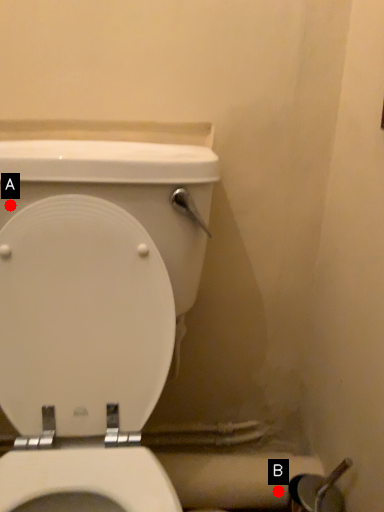
Question: Two points are circled on the image, labeled by A and B beside each circle. Among these points, which one is nearest to the camera?

Choices:
 (A) A is closer
 (B) B is closer

Answer: (A)